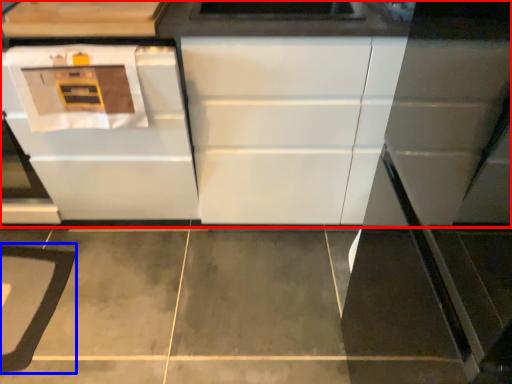
Question: Which object is closer to the camera taking this photo, cabinetry (highlighted by a red box) or mat (highlighted by a blue box)?

Choices:
 (A) cabinetry
 (B) mat

Answer: (A)